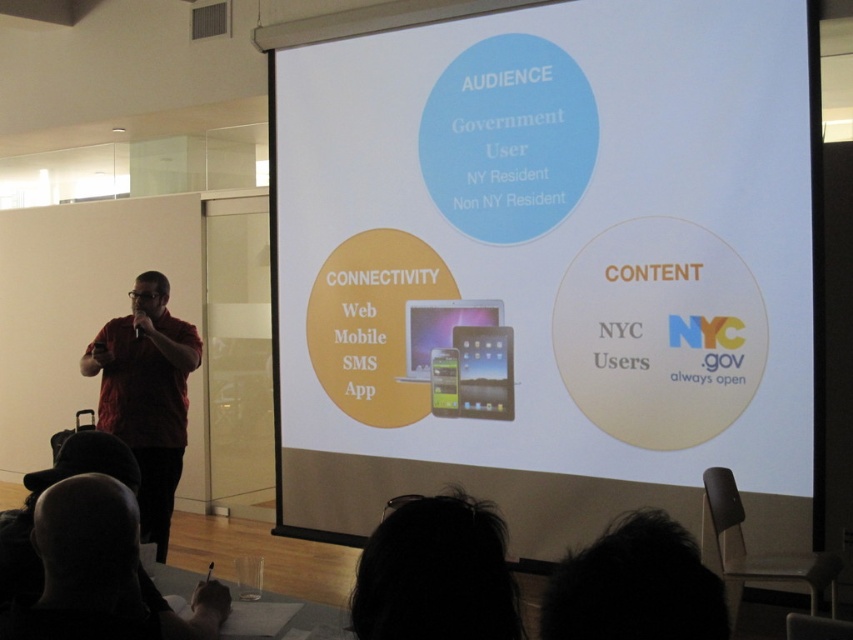
Who is positioned more to the right, white matte projection screen at center or black hair at lower left?

white matte projection screen at center

Between white matte projection screen at center and black hair at lower left, which one has less height?

Standing shorter between the two is black hair at lower left.

Who is more forward, (322,428) or (100,596)?

Point (100,596) is in front.

Find the location of a particular element. Image resolution: width=853 pixels, height=640 pixels. white matte projection screen at center is located at coordinates (550, 262).

Looking at this image, who is higher up, white matte projection screen at center or red shirt at left?

Positioned higher is white matte projection screen at center.

Describe the element at coordinates (550, 262) in the screenshot. The width and height of the screenshot is (853, 640). I see `white matte projection screen at center` at that location.

Where is `white matte projection screen at center`? Image resolution: width=853 pixels, height=640 pixels. white matte projection screen at center is located at coordinates (550, 262).

Is dark hair at lower center smaller than black hair at lower left?

Correct, dark hair at lower center occupies less space than black hair at lower left.

Which is below, dark hair at lower center or black hair at lower left?

black hair at lower left is lower down.

Between point (451, 573) and point (91, 490), which one is positioned behind?

Point (91, 490)

Locate an element on the screen. Image resolution: width=853 pixels, height=640 pixels. dark hair at lower center is located at coordinates (436, 573).